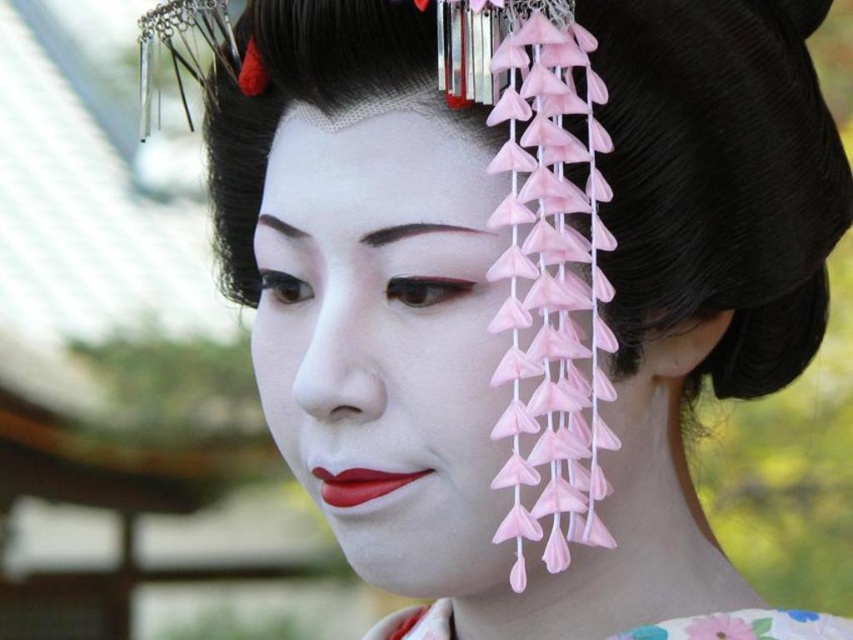
Is point (515, 148) positioned before point (337, 490)?

Yes, point (515, 148) is closer to viewer.

Where is `matte white face at center`? The image size is (853, 640). matte white face at center is located at coordinates (415, 305).

Who is more distant from viewer, (x=421, y=188) or (x=321, y=468)?

The point (x=321, y=468) is more distant.

I want to click on matte white face at center, so click(415, 305).

Does floral silk kimono at lower center appear under matte red lipstick at center?

Correct, floral silk kimono at lower center is located below matte red lipstick at center.

Does floral silk kimono at lower center have a lesser height compared to matte red lipstick at center?

No.

Does point (712, 634) come farther from viewer compared to point (337, 499)?

Yes, point (712, 634) is behind point (337, 499).

Image resolution: width=853 pixels, height=640 pixels. I want to click on floral silk kimono at lower center, so coord(746,627).

Who is more forward, (376, 106) or (822, 618)?

Point (376, 106)

Which of these two, matte white face at center or floral silk kimono at lower center, stands taller?

Standing taller between the two is matte white face at center.

Locate an element on the screen. This screenshot has width=853, height=640. matte white face at center is located at coordinates (415, 305).